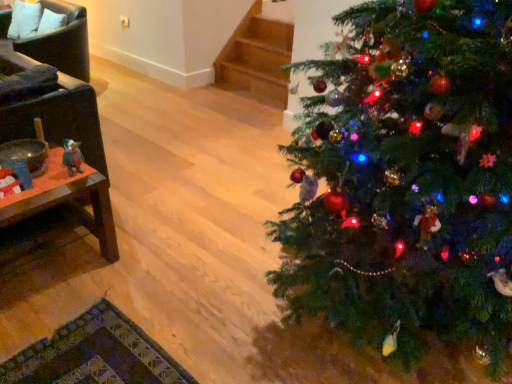
You are a GUI agent. You are given a task and a screenshot of the screen. Output one action in this format:
    pyautogui.click(x=<x>, y=<y>)
    Task: Click on the dark brown leather armchair at left, which appears as the 2th armchair when viewed from the top
    
    Given the screenshot: What is the action you would take?
    pyautogui.click(x=60, y=119)

The width and height of the screenshot is (512, 384). What do you see at coordinates (24, 20) in the screenshot?
I see `white fabric pillow at upper left` at bounding box center [24, 20].

The height and width of the screenshot is (384, 512). Describe the element at coordinates (62, 42) in the screenshot. I see `leather armchair at left, positioned as the first armchair in top-to-bottom order` at that location.

Where is `woodenmaterial/texturetable at left`? The width and height of the screenshot is (512, 384). woodenmaterial/texturetable at left is located at coordinates (67, 201).

This screenshot has width=512, height=384. Describe the element at coordinates (67, 201) in the screenshot. I see `woodenmaterial/texturetable at left` at that location.

The image size is (512, 384). Find the location of `dark brown leather armchair at left, acting as the 1th armchair starting from the bottom`. dark brown leather armchair at left, acting as the 1th armchair starting from the bottom is located at coordinates (60, 119).

Which of these two, dark brown leather armchair at left, the second armchair in the back-to-front sequence, or woodenmaterial/texturetable at left, is bigger?

dark brown leather armchair at left, the second armchair in the back-to-front sequence, is bigger.

Which is more distant, (54, 108) or (91, 187)?

Positioned behind is point (54, 108).

Can you confirm if dark brown leather armchair at left, acting as the 1th armchair starting from the bottom, is taller than woodenmaterial/texturetable at left?

Yes, dark brown leather armchair at left, acting as the 1th armchair starting from the bottom, is taller than woodenmaterial/texturetable at left.

Visually, is leather armchair at left, the 2th armchair positioned from the front, positioned to the left or to the right of white fabric pillow at upper left?

Based on their positions, leather armchair at left, the 2th armchair positioned from the front, is located to the right of white fabric pillow at upper left.

How many degrees apart are the facing directions of leather armchair at left, positioned as the first armchair in top-to-bottom order, and white fabric pillow at upper left?

12.1 degrees.

Is leather armchair at left, which ranks as the second armchair in bottom-to-top order, taller or shorter than white fabric pillow at upper left?

leather armchair at left, which ranks as the second armchair in bottom-to-top order, is taller than white fabric pillow at upper left.

Identify the location of armchair that is the 2nd object directly below the white fabric pillow at upper left (from a real-world perspective). (62, 42).

Could you measure the distance between leather armchair at left, which ranks as the second armchair in bottom-to-top order, and green matte christmas tree at right?

leather armchair at left, which ranks as the second armchair in bottom-to-top order, is 9.89 feet away from green matte christmas tree at right.

Between leather armchair at left, which ranks as the second armchair in bottom-to-top order, and green matte christmas tree at right, which one has more height?

Standing taller between the two is green matte christmas tree at right.

Find the location of `christmas tree that is below the leather armchair at left, which ranks as the second armchair in bottom-to-top order (from the image's perspective)`. christmas tree that is below the leather armchair at left, which ranks as the second armchair in bottom-to-top order (from the image's perspective) is located at coordinates pos(407,178).

Who is more distant, leather armchair at left, positioned as the first armchair in top-to-bottom order, or green matte christmas tree at right?

leather armchair at left, positioned as the first armchair in top-to-bottom order, is behind.

From the image's perspective, is green plush toy at left below dark brown leather armchair at left, which appears as the 2th armchair when viewed from the top?

Yes, from the image's perspective, green plush toy at left is below dark brown leather armchair at left, which appears as the 2th armchair when viewed from the top.

Considering the positions of points (64, 154) and (95, 136), is point (64, 154) farther from camera compared to point (95, 136)?

No, it is not.

Are green plush toy at left and dark brown leather armchair at left, the 1th armchair viewed from the front, far apart?

They are positioned close to each other.

Considering the sizes of objects dark brown leather armchair at left, the 1th armchair viewed from the front, and white fabric pillow at upper left in the image provided, who is shorter, dark brown leather armchair at left, the 1th armchair viewed from the front, or white fabric pillow at upper left?

white fabric pillow at upper left is shorter.

How many degrees apart are the facing directions of dark brown leather armchair at left, the second armchair in the back-to-front sequence, and white fabric pillow at upper left?

dark brown leather armchair at left, the second armchair in the back-to-front sequence, and white fabric pillow at upper left are facing 101 degrees away from each other.

Locate an element on the screen. pillow on the left of the dark brown leather armchair at left, the 1th armchair viewed from the front is located at coordinates (24, 20).

From the image's perspective, between dark brown leather armchair at left, the 1th armchair viewed from the front, and white fabric pillow at upper left, which one is located above?

From the image's view, white fabric pillow at upper left is above.

From a real-world perspective, which armchair is the 2nd one underneath the green plush toy at left? Please provide its 2D coordinates.

[(62, 42)]

Which of these two, leather armchair at left, positioned as the first armchair in top-to-bottom order, or green plush toy at left, is smaller?

Smaller between the two is green plush toy at left.

Are leather armchair at left, positioned as the first armchair in top-to-bottom order, and green plush toy at left making contact?

No, leather armchair at left, positioned as the first armchair in top-to-bottom order, is not next to green plush toy at left.

Does leather armchair at left, which ranks as the second armchair in bottom-to-top order, appear on the left side of green plush toy at left?

Indeed, leather armchair at left, which ranks as the second armchair in bottom-to-top order, is positioned on the left side of green plush toy at left.

Does leather armchair at left, acting as the first armchair starting from the back, have a greater width compared to woodenmaterial/texturetable at left?

Yes.

Which of these two, leather armchair at left, acting as the first armchair starting from the back, or woodenmaterial/texturetable at left, is smaller?

Smaller between the two is woodenmaterial/texturetable at left.

Is leather armchair at left, positioned as the first armchair in top-to-bottom order, not inside woodenmaterial/texturetable at left?

Yes, leather armchair at left, positioned as the first armchair in top-to-bottom order, is outside of woodenmaterial/texturetable at left.

Where is `table in front of the dark brown leather armchair at left, the second armchair in the back-to-front sequence`? table in front of the dark brown leather armchair at left, the second armchair in the back-to-front sequence is located at coordinates (67, 201).

What are the coordinates of `the 1st armchair below the white fabric pillow at upper left (from the image's perspective)` in the screenshot? It's located at (62, 42).

Based on their spatial positions, is green plush toy at left or white fabric pillow at upper left further from dark brown leather armchair at left, the 1th armchair viewed from the front?

white fabric pillow at upper left.

From the image, which object appears to be nearer to green matte christmas tree at right, dark brown leather armchair at left, acting as the 1th armchair starting from the bottom, or leather armchair at left, the 2th armchair positioned from the front?

The object closer to green matte christmas tree at right is dark brown leather armchair at left, acting as the 1th armchair starting from the bottom.

From the image, which object appears to be farther from woodenmaterial/texturetable at left, green matte christmas tree at right or white fabric pillow at upper left?

white fabric pillow at upper left lies further to woodenmaterial/texturetable at left than the other object.

From the image, which object appears to be nearer to green plush toy at left, green matte christmas tree at right or dark brown leather armchair at left, the 1th armchair viewed from the front?

Among the two, dark brown leather armchair at left, the 1th armchair viewed from the front, is located nearer to green plush toy at left.

Based on their spatial positions, is dark brown leather armchair at left, which appears as the 2th armchair when viewed from the top, or green matte christmas tree at right closer to woodenmaterial/texturetable at left?

Based on the image, dark brown leather armchair at left, which appears as the 2th armchair when viewed from the top, appears to be nearer to woodenmaterial/texturetable at left.

Based on their spatial positions, is dark brown leather armchair at left, the second armchair in the back-to-front sequence, or leather armchair at left, which ranks as the second armchair in bottom-to-top order, closer to white fabric pillow at upper left?

leather armchair at left, which ranks as the second armchair in bottom-to-top order.

When comparing their distances from leather armchair at left, the 2th armchair positioned from the front, does dark brown leather armchair at left, the second armchair in the back-to-front sequence, or green matte christmas tree at right seem further?

Based on the image, green matte christmas tree at right appears to be further to leather armchair at left, the 2th armchair positioned from the front.

Considering their positions, is woodenmaterial/texturetable at left positioned closer to leather armchair at left, acting as the first armchair starting from the back, than dark brown leather armchair at left, the 1th armchair viewed from the front?

The object closer to leather armchair at left, acting as the first armchair starting from the back, is dark brown leather armchair at left, the 1th armchair viewed from the front.

Find the location of `armchair positioned between woodenmaterial/texturetable at left and leather armchair at left, acting as the first armchair starting from the back, from near to far`. armchair positioned between woodenmaterial/texturetable at left and leather armchair at left, acting as the first armchair starting from the back, from near to far is located at coordinates (60, 119).

At what (x,y) coordinates should I click in order to perform the action: click on toy between woodenmaterial/texturetable at left and white fabric pillow at upper left from front to back. Please return your answer as a coordinate pair (x, y). Looking at the image, I should click on (72, 157).

Where is `table between dark brown leather armchair at left, acting as the 1th armchair starting from the bottom, and green matte christmas tree at right, in the horizontal direction`? table between dark brown leather armchair at left, acting as the 1th armchair starting from the bottom, and green matte christmas tree at right, in the horizontal direction is located at coordinates (67, 201).

This screenshot has height=384, width=512. What are the coordinates of `table situated between dark brown leather armchair at left, the 1th armchair viewed from the front, and green plush toy at left from left to right` in the screenshot? It's located at (67, 201).